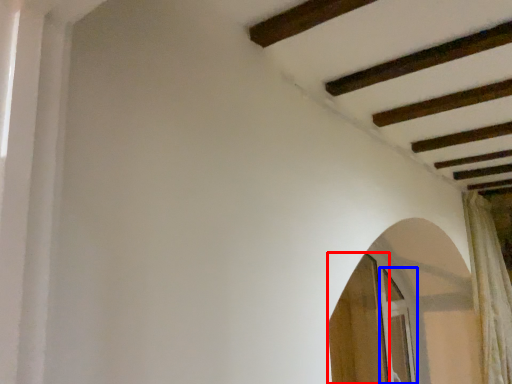
Question: Among these objects, which one is farthest to the camera, screen door (highlighted by a red box) or screen door (highlighted by a blue box)?

Choices:
 (A) screen door
 (B) screen door

Answer: (B)